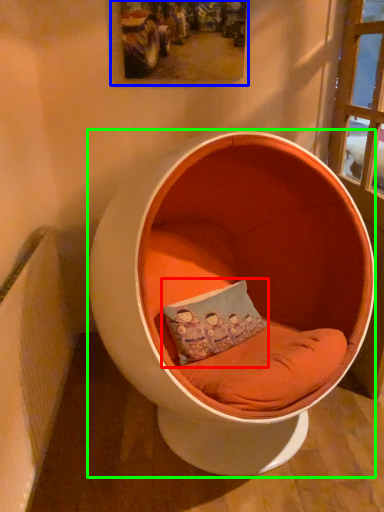
Question: Which object is the closest to the pillow (highlighted by a red box)? Choose among these: picture frame (highlighted by a blue box) or furniture (highlighted by a green box).

Choices:
 (A) picture frame
 (B) furniture

Answer: (B)